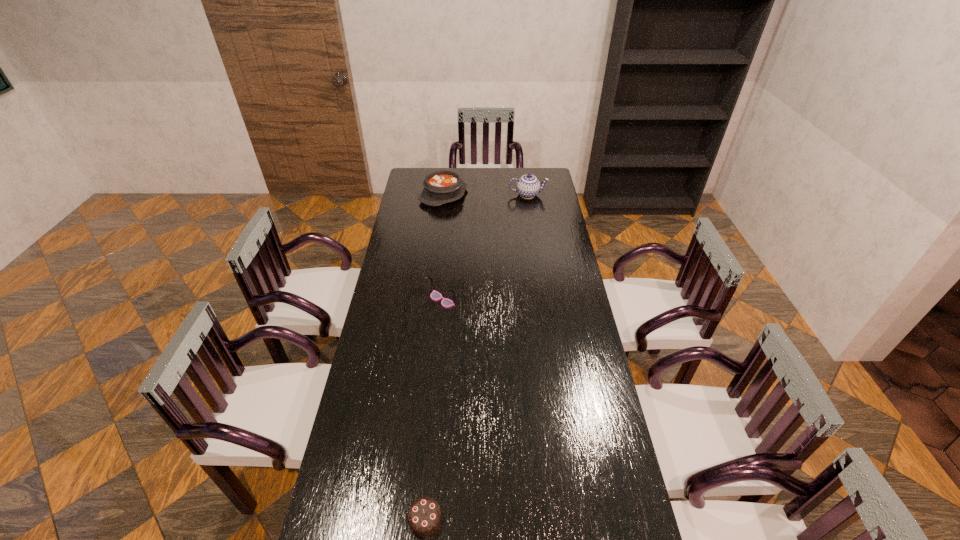
Select which object appears as the second closest to the chocolate cake. Please provide its 2D coordinates. Your answer should be formatted as a tuple, i.e. [(x, y)], where the tuple contains the x and y coordinates of a point satisfying the conditions above.

[(443, 186)]

You are a GUI agent. You are given a task and a screenshot of the screen. Output one action in this format:
    pyautogui.click(x=<x>, y=<y>)
    Task: Click on the object that is the nearest to the rightmost object
    This screenshot has height=540, width=960.
    Given the screenshot: What is the action you would take?
    pyautogui.click(x=443, y=186)

Identify the location of free location that satisfies the following two spatial constraints: 1. at the spout of the tallest object; 2. on the front side of the casserole. (528, 195).